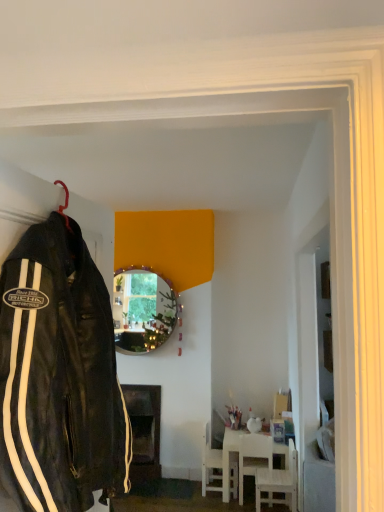
Question: From the image's perspective, is shiny gold mirror at center located above or below black leather jacket at left?

Choices:
 (A) above
 (B) below

Answer: (B)

Question: Considering the positions of shiny gold mirror at center and black leather jacket at left in the image, is shiny gold mirror at center taller or shorter than black leather jacket at left?

Choices:
 (A) short
 (B) tall

Answer: (A)

Question: Which object is the farthest from the white matte table at lower center, acting as the second table starting from the left?

Choices:
 (A) white plastic chair at lower center, which is the first chair from left to right
 (B) wooden table at center, acting as the 2th table starting from the right
 (C) white wooden chair at lower right, arranged as the 3th chair when viewed from the left
 (D) black leather jacket at left
 (E) shiny gold mirror at center

Answer: (D)

Question: Which object is positioned closest to the white plastic chair at lower center, positioned as the 3th chair in right-to-left order?

Choices:
 (A) white wood chair at lower center, acting as the second chair starting from the left
 (B) black leather jacket at left
 (C) wooden table at center, which is the 1th table in left-to-right order
 (D) shiny gold mirror at center
 (E) white matte table at lower center, acting as the second table starting from the left

Answer: (E)